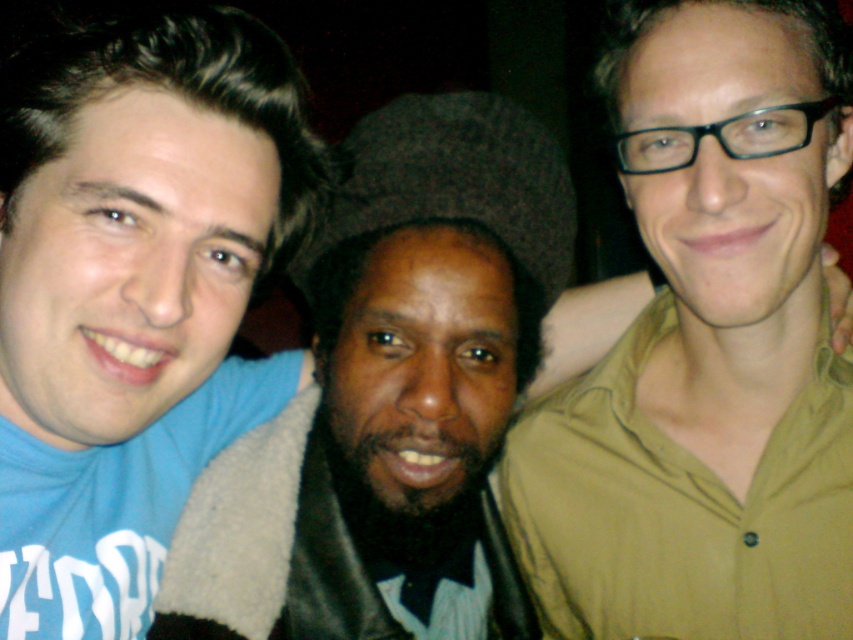
Question: Which object appears farthest from the camera in this image?

Choices:
 (A) blue t-shirt at left
 (B) green matte shirt at right

Answer: (B)

Question: From the image, what is the correct spatial relationship of green matte shirt at right in relation to blue t-shirt at left?

Choices:
 (A) left
 (B) right

Answer: (B)

Question: Is green matte shirt at right to the left of blue t-shirt at left from the viewer's perspective?

Choices:
 (A) no
 (B) yes

Answer: (A)

Question: Which point is farther to the camera?

Choices:
 (A) (20, 627)
 (B) (693, 259)

Answer: (A)

Question: Among these points, which one is nearest to the camera?

Choices:
 (A) (784, 173)
 (B) (48, 276)

Answer: (B)

Question: Is green matte shirt at right closer to camera compared to blue t-shirt at left?

Choices:
 (A) no
 (B) yes

Answer: (A)